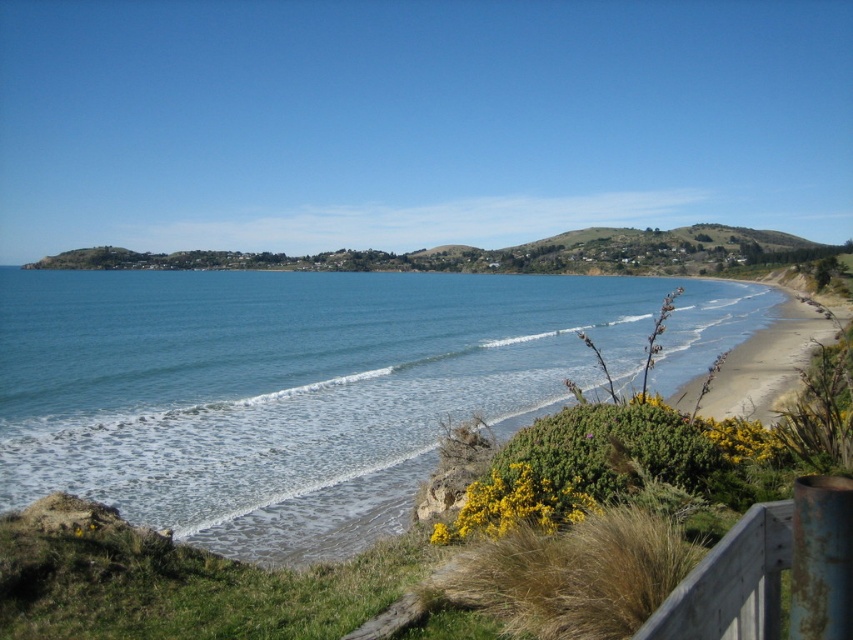
You are standing at the edge of the cliff and want to take a photo of the blue water at center. Where should you aim your camera to capture it?

You should aim your camera at point 0.605 on the x axis and 0.361 on the y axis to capture the blue water at center.

You are planning to build a small boat dock. The dock requires a large enough area of water to be anchored. Based on the scene, which area would be suitable for anchoring the dock, the blue water at center or the light brown sandy beach at right? Explain your choice using the objects mentioned.

The blue water at center is bigger than the light brown sandy beach at right, so the blue water at center would be suitable for anchoring the dock as it provides a larger area of water.

You are standing on a cliff overlooking the coast. You see the blue water at center and the light brown sandy beach at right. Which one appears higher from your viewpoint?

The blue water at center appears higher than the light brown sandy beach at right because it is much taller as seen from the cliff viewpoint.